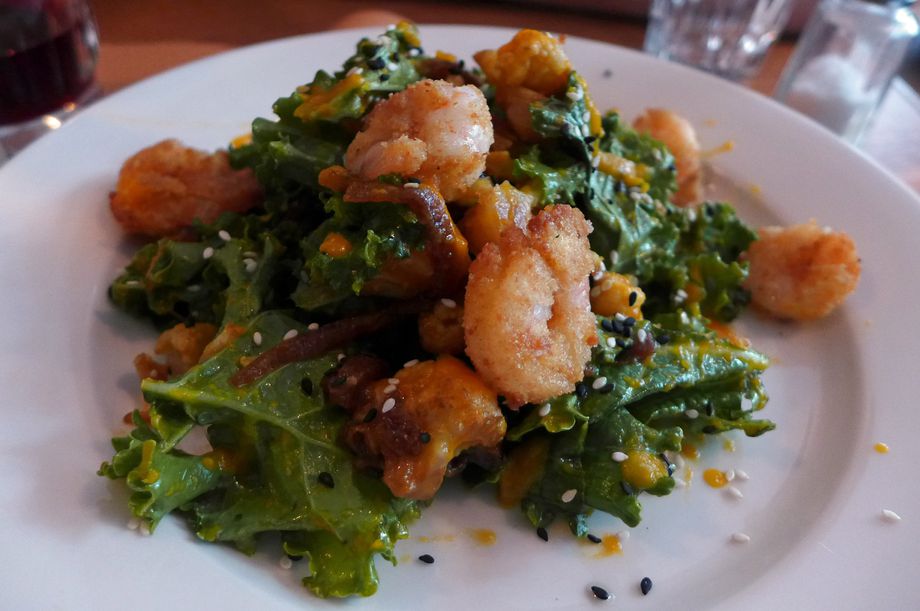
This screenshot has width=920, height=611. Identify the location of empty glass. (719, 21).